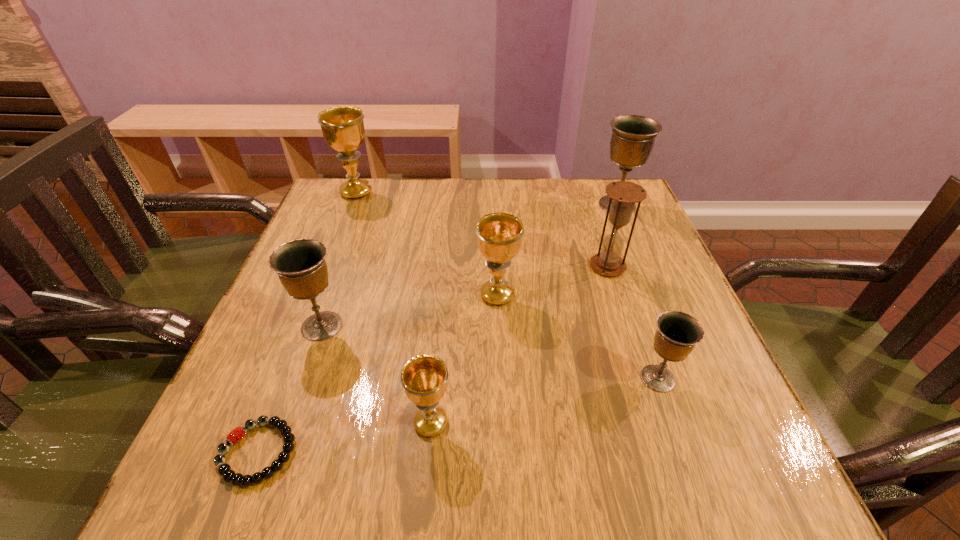
In order to click on the fifth object from right to left in this screenshot , I will do `click(424, 378)`.

The height and width of the screenshot is (540, 960). I want to click on the third nearest object, so click(677, 333).

What are the coordinates of `the fifth farthest chalice` in the screenshot? It's located at (677, 333).

At what (x,y) coordinates should I click in order to perform the action: click on black bracelet. Please return your answer as a coordinate pair (x, y). Image resolution: width=960 pixels, height=540 pixels. Looking at the image, I should click on (224, 469).

You are a GUI agent. You are given a task and a screenshot of the screen. Output one action in this format:
    pyautogui.click(x=<x>, y=<y>)
    Task: Click on the bracelet
    The height and width of the screenshot is (540, 960).
    Given the screenshot: What is the action you would take?
    pyautogui.click(x=224, y=469)

Locate an element on the screen. The width and height of the screenshot is (960, 540). free space located on the front of the biggest gold chalice is located at coordinates (346, 220).

At what (x,y) coordinates should I click in order to perform the action: click on vacant area situated 0.110m on the front of the biggest bronze chalice. Please return your answer as a coordinate pair (x, y). The height and width of the screenshot is (540, 960). Looking at the image, I should click on (634, 243).

Locate an element on the screen. vacant space situated 0.400m on the left of the hourglass is located at coordinates (x=415, y=266).

Identify the location of vacant space situated 0.400m on the right of the leftmost bronze chalice. (549, 326).

The width and height of the screenshot is (960, 540). I want to click on free space located on the left of the rightmost gold chalice, so point(444,295).